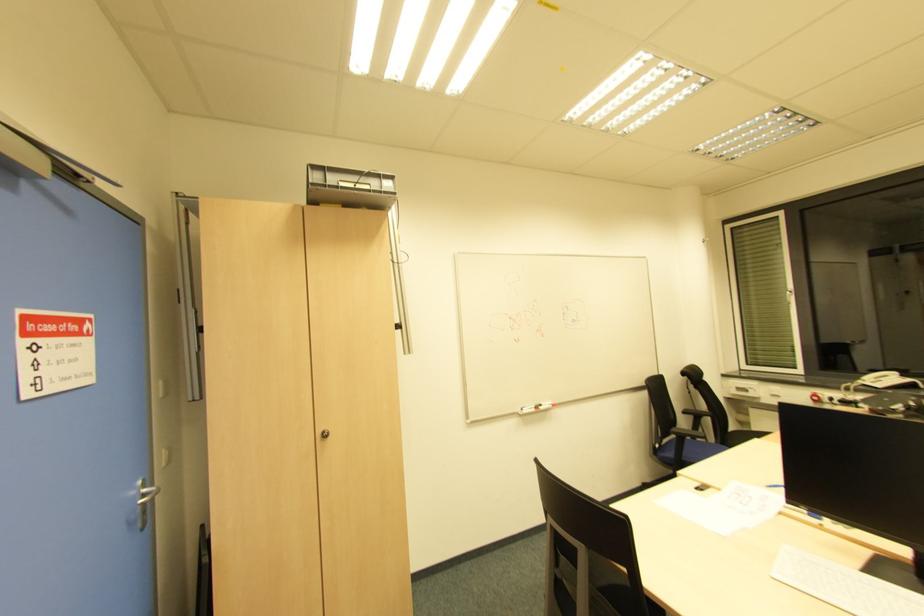
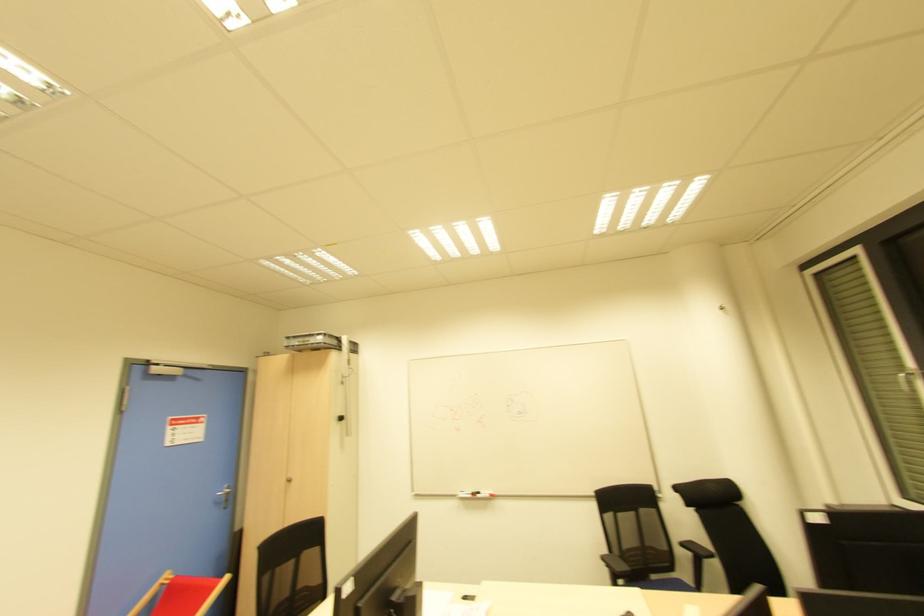
Where in the second image is the point corresponding to [685,413] from the first image?

(681, 545)